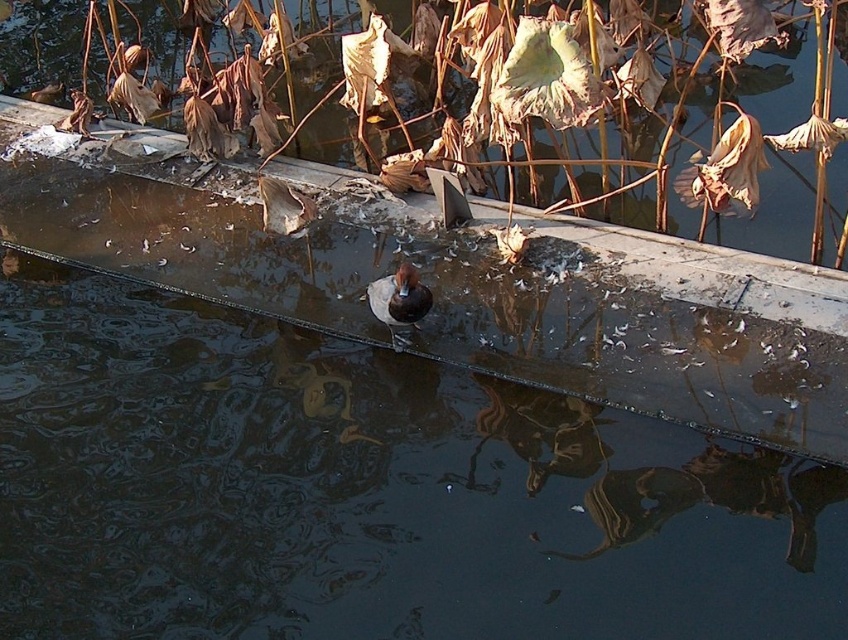
Consider the image. Is brown dried leaves at upper center smaller than brown matte duck at center?

Incorrect, brown dried leaves at upper center is not smaller in size than brown matte duck at center.

Which of these two, brown dried leaves at upper center or brown matte duck at center, stands taller?

Standing taller between the two is brown dried leaves at upper center.

What do you see at coordinates (487, 99) in the screenshot? I see `brown dried leaves at upper center` at bounding box center [487, 99].

You are a GUI agent. You are given a task and a screenshot of the screen. Output one action in this format:
    pyautogui.click(x=<x>, y=<y>)
    Task: Click on the brown dried leaves at upper center
    
    Given the screenshot: What is the action you would take?
    click(487, 99)